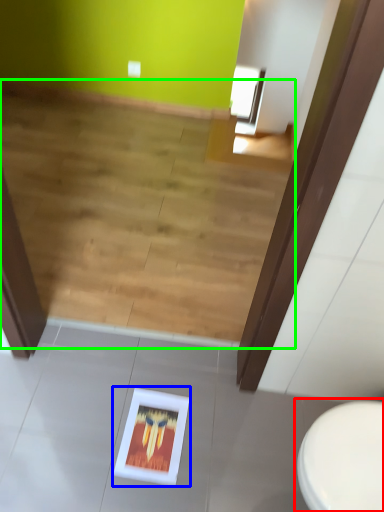
Question: Based on their relative distances, which object is nearer to toilet (highlighted by a red box)? Choose from picture frame (highlighted by a blue box) and stairwell (highlighted by a green box).

Choices:
 (A) picture frame
 (B) stairwell

Answer: (A)